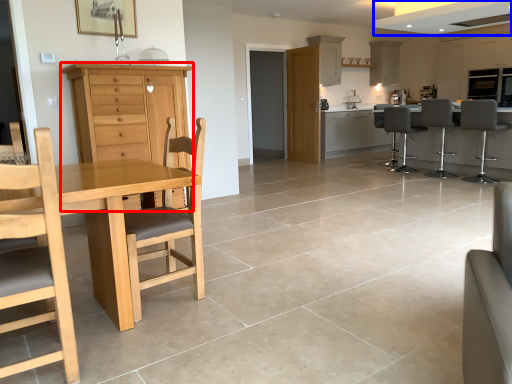
Question: Which point is closer to the camera, cabinetry (highlighted by a red box) or exhaust hood (highlighted by a blue box)?

Choices:
 (A) cabinetry
 (B) exhaust hood

Answer: (A)